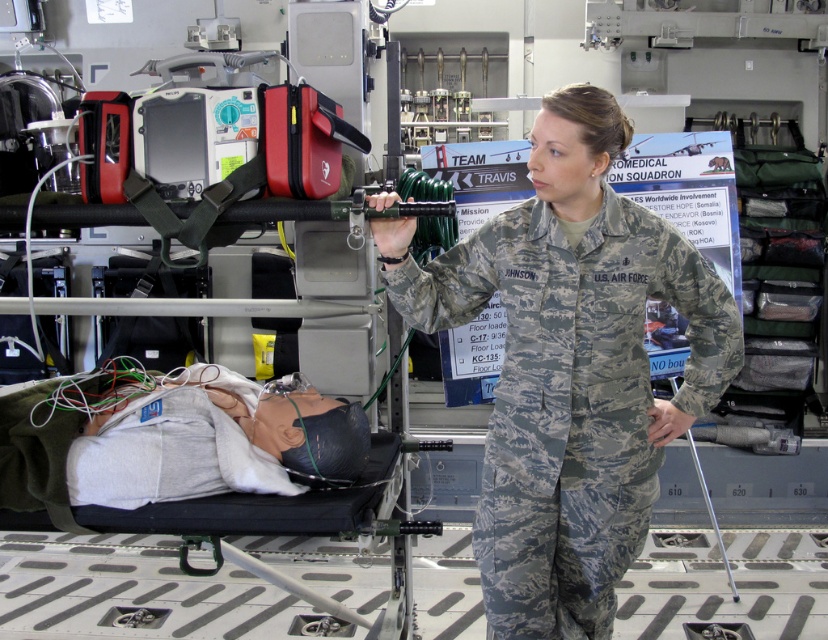
Who is shorter, camouflage uniform at center or camouflage fabric stretcher at center?

Standing shorter between the two is camouflage fabric stretcher at center.

Is camouflage uniform at center thinner than camouflage fabric stretcher at center?

Yes, camouflage uniform at center is thinner than camouflage fabric stretcher at center.

Is point (432, 308) positioned behind point (20, 394)?

No.

Where is `camouflage uniform at center`? camouflage uniform at center is located at coordinates (570, 368).